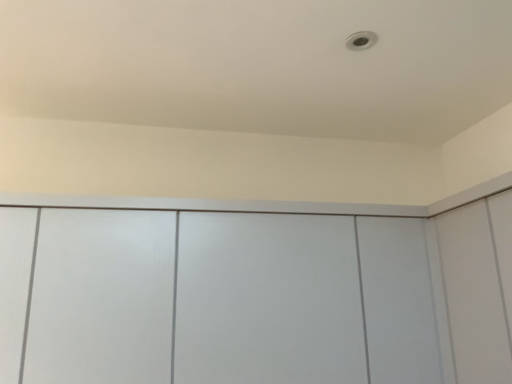
Identify the location of white matte cabinet at center. The image size is (512, 384). (214, 298).

The width and height of the screenshot is (512, 384). What do you see at coordinates (214, 298) in the screenshot?
I see `white matte cabinet at center` at bounding box center [214, 298].

You are a GUI agent. You are given a task and a screenshot of the screen. Output one action in this format:
    pyautogui.click(x=<x>, y=<y>)
    Task: Click on the white matte cabinet at center
    This screenshot has width=512, height=384.
    Given the screenshot: What is the action you would take?
    pyautogui.click(x=214, y=298)